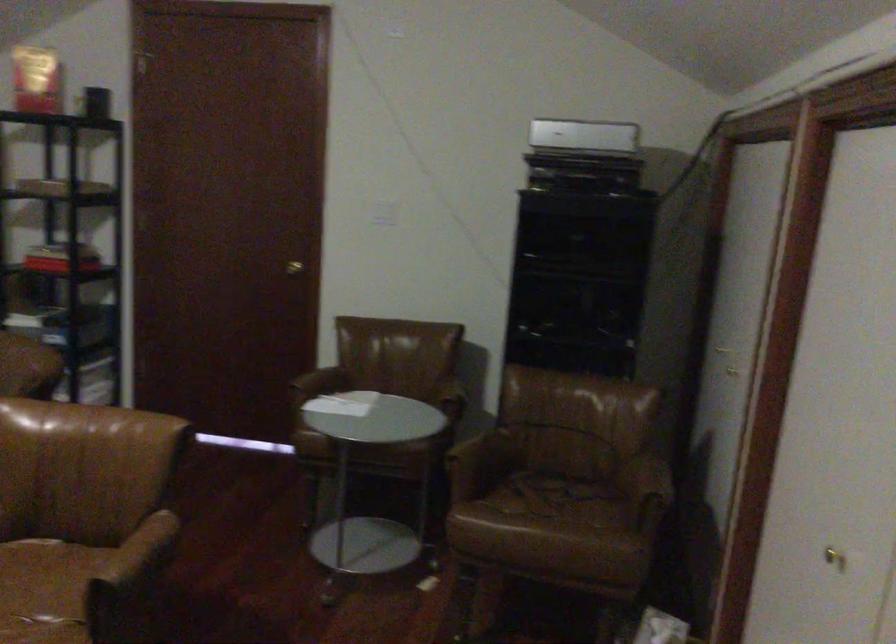
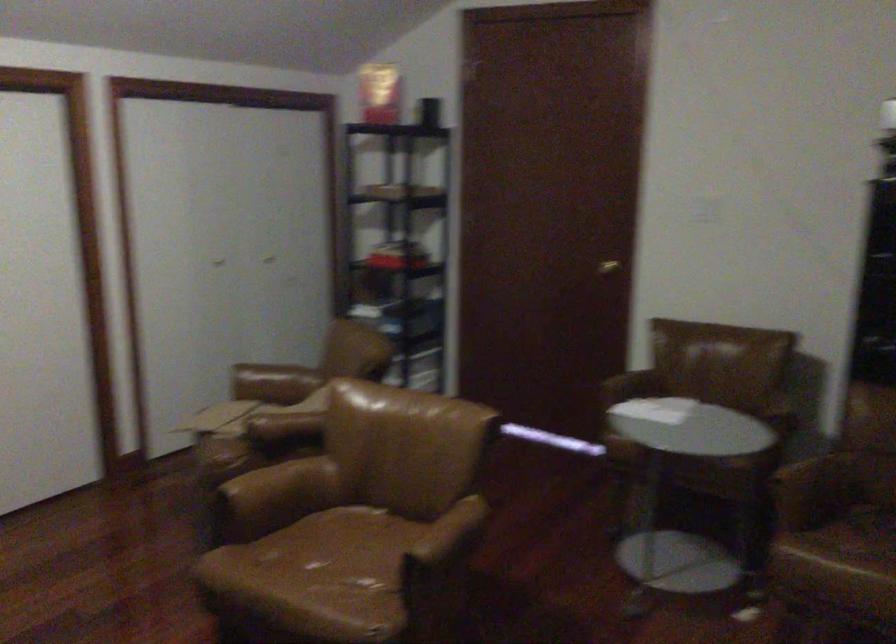
Question: The first image is from the beginning of the video and the second image is from the end. How did the camera likely rotate when shooting the video?

Choices:
 (A) Left
 (B) Right
 (C) Up
 (D) Down

Answer: (A)